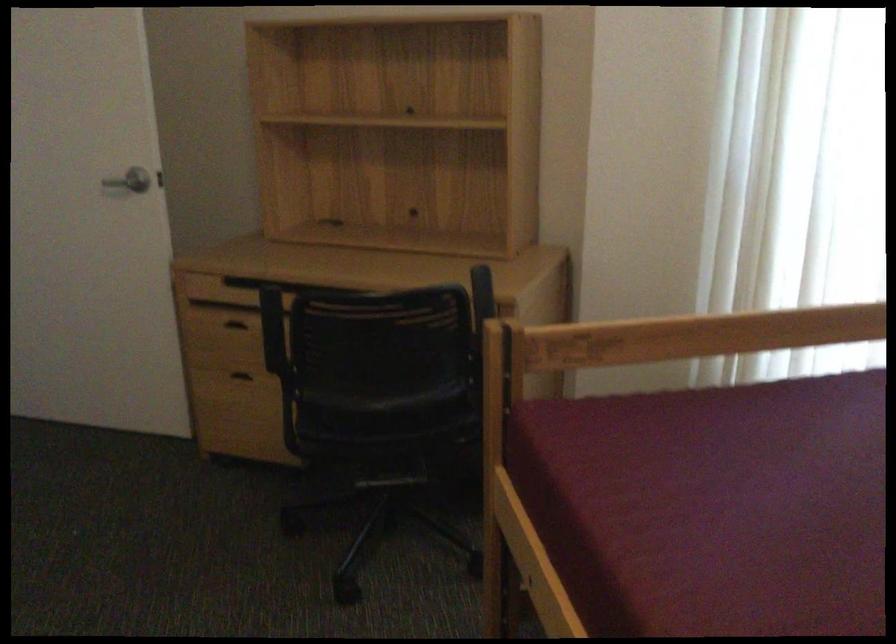
Identify the location of silver door handle. The height and width of the screenshot is (644, 896). (126, 182).